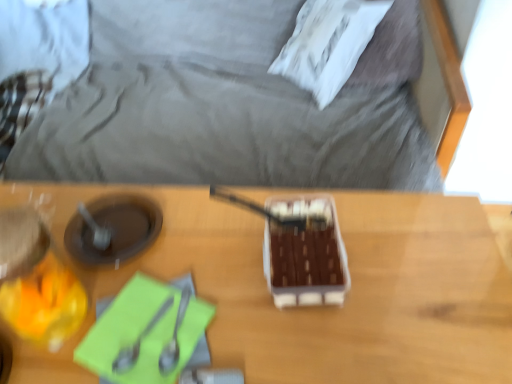
In order to click on satin silver spoon at lower left, placed as the 1th utensil when sorted from left to right in this screenshot , I will do `click(138, 341)`.

What do you see at coordinates (145, 333) in the screenshot? I see `green matte notepad at lower left` at bounding box center [145, 333].

Where is `white soft pillow at upper center`? Image resolution: width=512 pixels, height=384 pixels. white soft pillow at upper center is located at coordinates (328, 44).

Identify the location of satin silver spoon at lower left, which is the second utensil in right-to-left order. The image size is (512, 384). (138, 341).

Between satin silver spoon at center, marked as the 1th utensil in a right-to-left arrangement, and satin silver spoon at lower left, placed as the 1th utensil when sorted from left to right, which one appears on the left side from the viewer's perspective?

Positioned to the left is satin silver spoon at lower left, placed as the 1th utensil when sorted from left to right.

Can you confirm if satin silver spoon at center, the second utensil positioned from the left, is smaller than satin silver spoon at lower left, which is the second utensil in right-to-left order?

Yes.

In order to click on utensil below the satin silver spoon at center, the second utensil positioned from the left (from the image's perspective) in this screenshot , I will do `click(138, 341)`.

Which is behind, point (178, 323) or point (122, 363)?

The point (178, 323) is farther.

How much distance is there between satin silver spoon at center, the second utensil positioned from the left, and green matte notepad at lower left?

4.66 centimeters.

Does point (183, 296) lie in front of point (175, 339)?

No, (183, 296) is behind (175, 339).

Is satin silver spoon at center, the second utensil positioned from the left, positioned beyond the bounds of green matte notepad at lower left?

Actually, satin silver spoon at center, the second utensil positioned from the left, is within green matte notepad at lower left.

Considering the positions of objects satin silver spoon at center, marked as the 1th utensil in a right-to-left arrangement, and green matte notepad at lower left in the image provided, who is more to the right, satin silver spoon at center, marked as the 1th utensil in a right-to-left arrangement, or green matte notepad at lower left?

Positioned to the right is satin silver spoon at center, marked as the 1th utensil in a right-to-left arrangement.

From a real-world perspective, which object stands above the other?

From a 3D spatial view, satin silver spoon at lower left, placed as the 1th utensil when sorted from left to right, is above.

Who is bigger, satin silver spoon at lower left, which is the second utensil in right-to-left order, or green matte notepad at lower left?

Bigger between the two is green matte notepad at lower left.

Which is in front, satin silver spoon at lower left, which is the second utensil in right-to-left order, or green matte notepad at lower left?

green matte notepad at lower left.

Can you tell me how much satin silver spoon at lower left, which is the second utensil in right-to-left order, and green matte notepad at lower left differ in facing direction?

satin silver spoon at lower left, which is the second utensil in right-to-left order, and green matte notepad at lower left are facing 0.00291 degrees away from each other.

Could you tell me if satin silver spoon at center, marked as the 1th utensil in a right-to-left arrangement, is facing brown matte chocolate bar at center?

No, satin silver spoon at center, marked as the 1th utensil in a right-to-left arrangement, is not facing towards brown matte chocolate bar at center.

Find the location of a particular element. food above the satin silver spoon at center, marked as the 1th utensil in a right-to-left arrangement (from the image's perspective) is located at coordinates (305, 255).

Is satin silver spoon at center, marked as the 1th utensil in a right-to-left arrangement, not close to brown matte chocolate bar at center?

No, satin silver spoon at center, marked as the 1th utensil in a right-to-left arrangement, is not far away from brown matte chocolate bar at center.

Considering the relative positions of satin silver spoon at center, the second utensil positioned from the left, and brown matte chocolate bar at center in the image provided, is satin silver spoon at center, the second utensil positioned from the left, to the left or to the right of brown matte chocolate bar at center?

satin silver spoon at center, the second utensil positioned from the left, is to the left of brown matte chocolate bar at center.

Find the location of a particular element. the 2nd utensil counting from the right side of the wooden table at center is located at coordinates (174, 337).

Considering the relative sizes of wooden table at center and satin silver spoon at center, marked as the 1th utensil in a right-to-left arrangement, in the image provided, is wooden table at center wider than satin silver spoon at center, marked as the 1th utensil in a right-to-left arrangement,?

Yes.

Based on the photo, considering the relative positions of wooden table at center and satin silver spoon at center, the second utensil positioned from the left, in the image provided, is wooden table at center to the left of satin silver spoon at center, the second utensil positioned from the left, from the viewer's perspective?

Yes, wooden table at center is to the left of satin silver spoon at center, the second utensil positioned from the left.

Is wooden table at center located outside satin silver spoon at center, the second utensil positioned from the left?

Yes, wooden table at center is outside of satin silver spoon at center, the second utensil positioned from the left.

In the scene shown: From the image's perspective, is satin silver spoon at lower left, which is the second utensil in right-to-left order, above wooden table at center?

Indeed, from the image's perspective, satin silver spoon at lower left, which is the second utensil in right-to-left order, is shown above wooden table at center.

Who is shorter, satin silver spoon at lower left, which is the second utensil in right-to-left order, or wooden table at center?

With less height is satin silver spoon at lower left, which is the second utensil in right-to-left order.

From a real-world perspective, is satin silver spoon at lower left, which is the second utensil in right-to-left order, located beneath wooden table at center?

No, from a real-world perspective, satin silver spoon at lower left, which is the second utensil in right-to-left order, is not under wooden table at center.

Which of these two, green matte notepad at lower left or satin silver spoon at lower left, placed as the 1th utensil when sorted from left to right, stands shorter?

green matte notepad at lower left.

Is satin silver spoon at lower left, which is the second utensil in right-to-left order, completely or partially inside green matte notepad at lower left?

Yes, satin silver spoon at lower left, which is the second utensil in right-to-left order, can be found within green matte notepad at lower left.

Based on the photo, could you tell me if green matte notepad at lower left is facing satin silver spoon at lower left, placed as the 1th utensil when sorted from left to right?

Yes, green matte notepad at lower left faces towards satin silver spoon at lower left, placed as the 1th utensil when sorted from left to right.

From the image's perspective, is green matte notepad at lower left under satin silver spoon at lower left, placed as the 1th utensil when sorted from left to right?

Yes, from the image's perspective, green matte notepad at lower left is below satin silver spoon at lower left, placed as the 1th utensil when sorted from left to right.

This screenshot has height=384, width=512. Identify the location of utensil on the left of satin silver spoon at center, marked as the 1th utensil in a right-to-left arrangement. (138, 341).

The height and width of the screenshot is (384, 512). I want to click on notepad located in front of the satin silver spoon at center, marked as the 1th utensil in a right-to-left arrangement, so click(x=145, y=333).

Estimate the real-world distances between objects in this image. Which object is closer to wooden table at center, green matte notepad at lower left or white soft pillow at upper center?

green matte notepad at lower left.

Based on their spatial positions, is satin silver spoon at lower left, placed as the 1th utensil when sorted from left to right, or green matte notepad at lower left further from brown matte chocolate bar at center?

Based on the image, satin silver spoon at lower left, placed as the 1th utensil when sorted from left to right, appears to be further to brown matte chocolate bar at center.

Looking at the image, which one is located closer to wooden table at center, brown matte chocolate bar at center or satin silver spoon at center, marked as the 1th utensil in a right-to-left arrangement?

Based on the image, brown matte chocolate bar at center appears to be nearer to wooden table at center.

Looking at the image, which one is located further to brown matte chocolate bar at center, satin silver spoon at lower left, which is the second utensil in right-to-left order, or satin silver spoon at center, the second utensil positioned from the left?

satin silver spoon at lower left, which is the second utensil in right-to-left order, is further to brown matte chocolate bar at center.

When comparing their distances from green matte notepad at lower left, does satin silver spoon at lower left, which is the second utensil in right-to-left order, or wooden table at center seem closer?

satin silver spoon at lower left, which is the second utensil in right-to-left order.

Estimate the real-world distances between objects in this image. Which object is closer to brown matte chocolate bar at center, green matte notepad at lower left or white soft pillow at upper center?

The object closer to brown matte chocolate bar at center is green matte notepad at lower left.

Considering their positions, is wooden table at center positioned closer to brown matte chocolate bar at center than satin silver spoon at lower left, placed as the 1th utensil when sorted from left to right?

wooden table at center is closer to brown matte chocolate bar at center.

Which object lies nearer to the anchor point satin silver spoon at center, the second utensil positioned from the left, satin silver spoon at lower left, which is the second utensil in right-to-left order, or wooden table at center?

Among the two, satin silver spoon at lower left, which is the second utensil in right-to-left order, is located nearer to satin silver spoon at center, the second utensil positioned from the left.

You are a GUI agent. You are given a task and a screenshot of the screen. Output one action in this format:
    pyautogui.click(x=<x>, y=<y>)
    Task: Click on the utensil between green matte notepad at lower left and brown matte chocolate bar at center in the horizontal direction
    
    Given the screenshot: What is the action you would take?
    pyautogui.click(x=174, y=337)

Find the location of a particular element. food between white soft pillow at upper center and green matte notepad at lower left in the vertical direction is located at coordinates (305, 255).

Where is `utensil located between satin silver spoon at lower left, which is the second utensil in right-to-left order, and brown matte chocolate bar at center in the left-right direction`? The height and width of the screenshot is (384, 512). utensil located between satin silver spoon at lower left, which is the second utensil in right-to-left order, and brown matte chocolate bar at center in the left-right direction is located at coordinates (174, 337).

Identify the location of food between white soft pillow at upper center and satin silver spoon at center, the second utensil positioned from the left, in the vertical direction. The height and width of the screenshot is (384, 512). (305, 255).